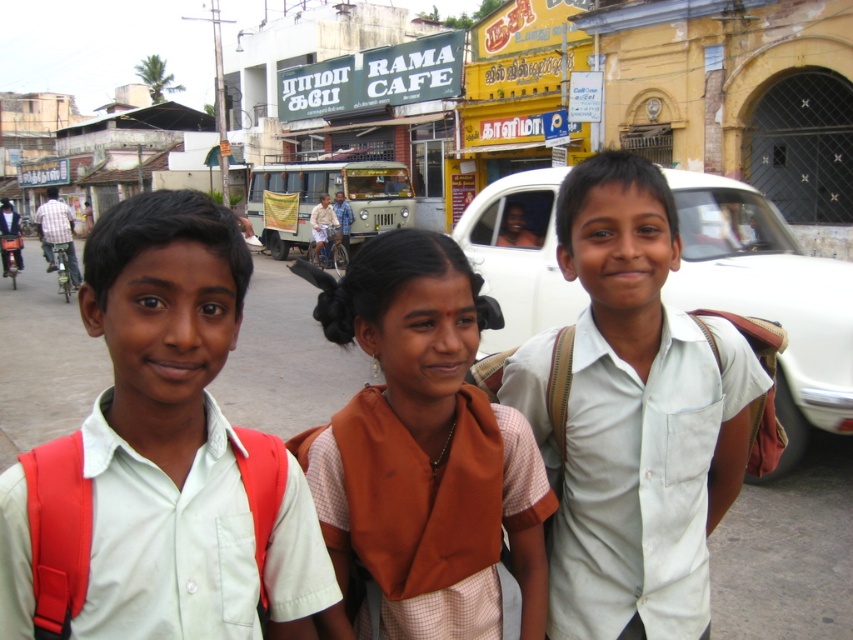
Question: Can you confirm if light green shirt at center is bigger than white cotton shirt at center?

Choices:
 (A) yes
 (B) no

Answer: (A)

Question: Which object is closer to the camera taking this photo?

Choices:
 (A) light green shirt at center
 (B) orange fabric sari at center

Answer: (A)

Question: Is orange fabric sari at center smaller than white matte car at center?

Choices:
 (A) no
 (B) yes

Answer: (B)

Question: Which point is farther to the camera?

Choices:
 (A) (585, 580)
 (B) (462, 339)

Answer: (A)

Question: Which of the following is the closest to the observer?

Choices:
 (A) light green shirt at center
 (B) white matte car at center
 (C) orange fabric sari at center

Answer: (A)

Question: Does light green shirt at center appear over white cotton shirt at center?

Choices:
 (A) yes
 (B) no

Answer: (A)